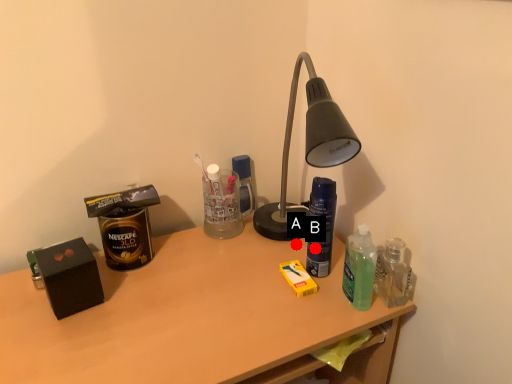
Question: Two points are circled on the image, labeled by A and B beside each circle. Which point is farther from the camera taking this photo?

Choices:
 (A) A is further
 (B) B is further

Answer: (A)